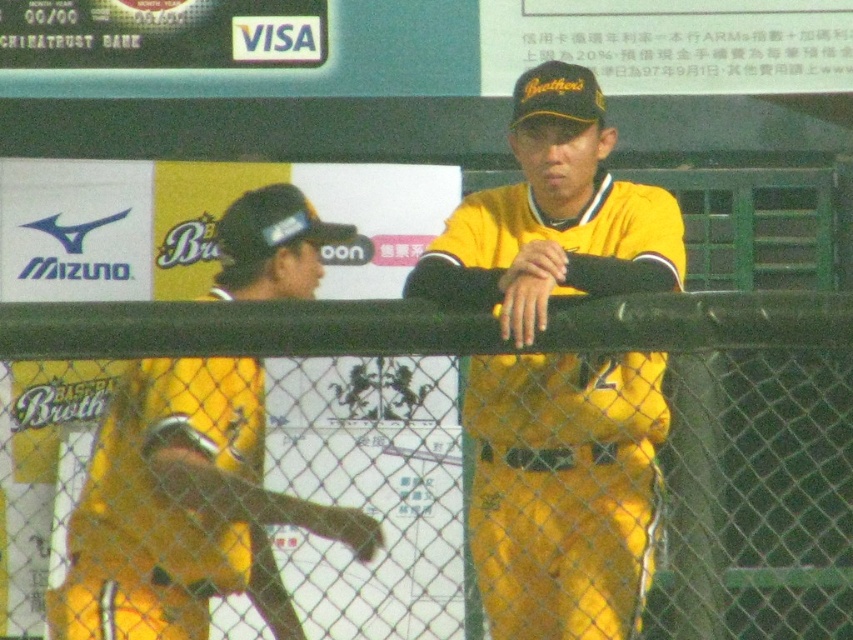
You are a photographer standing in the dugout and want to take a photo of the yellow matte uniform at center and the yellow matte baseball bat at left. Which object should you focus on first if you want to capture both in the same frame without moving the camera?

You should focus on the yellow matte uniform at center first because it is much taller than the yellow matte baseball bat at left, ensuring it will be properly framed in the shot.

You are a photographer standing in the dugout area. You want to take a photo of the yellow matte uniform at center and the yellow matte baseball bat at left. Based on their positions, which object should you focus on first to ensure both are in the frame?

The yellow matte uniform at center is positioned over the yellow matte baseball bat at left, so you should focus on the yellow matte uniform at center first to ensure both are in the frame.